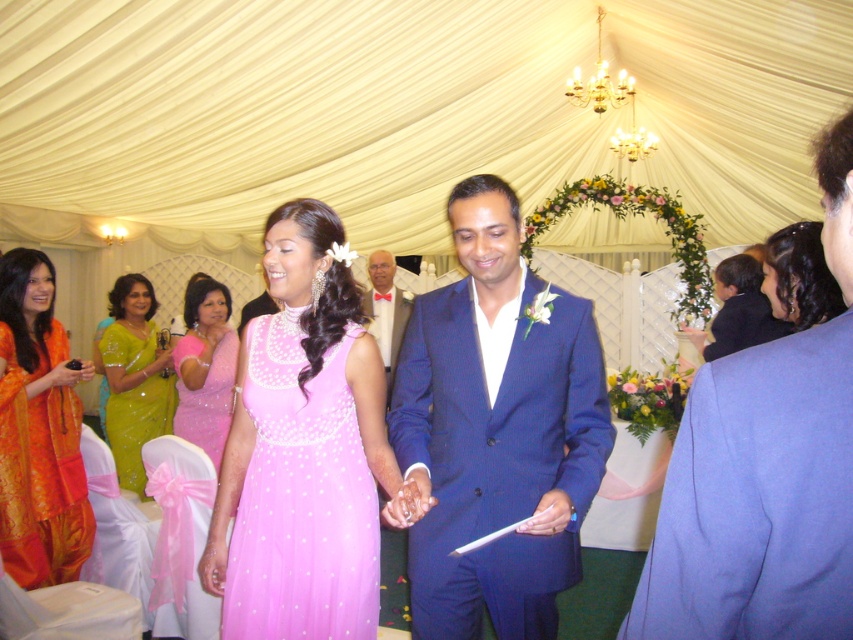
You are a photographer at the wedding venue. You need to position the blue wool suit at center and the green sequined sari at left in a way that they are both visible in the frame. Given their widths, which one should be placed closer to the camera to ensure both fit in the photo?

The blue wool suit at center is thinner than the green sequined sari at left, so placing the green sequined sari at left closer to the camera will allow both to fit in the frame as the wider object requires more space.